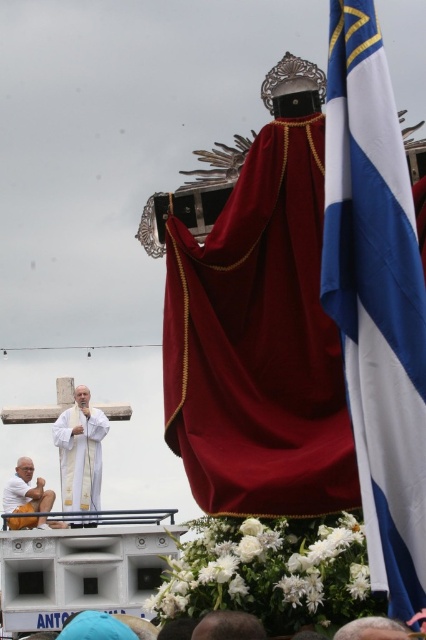
From the picture: Who is positioned more to the left, velvet deep red cape at center or smooth brown leather hat at lower center?

From the viewer's perspective, velvet deep red cape at center appears more on the left side.

Can you confirm if velvet deep red cape at center is shorter than smooth brown leather hat at lower center?

Incorrect, velvet deep red cape at center's height does not fall short of smooth brown leather hat at lower center's.

Between point (262, 424) and point (351, 636), which one is positioned behind?

Positioned behind is point (262, 424).

Identify the location of velvet deep red cape at center. (259, 342).

Does velvet deep red cape at center have a greater width compared to white cotton robe at lower left?

Yes.

Between velvet deep red cape at center and white cotton robe at lower left, which one has more height?

With more height is velvet deep red cape at center.

Where is `velvet deep red cape at center`? The width and height of the screenshot is (426, 640). velvet deep red cape at center is located at coordinates (259, 342).

The width and height of the screenshot is (426, 640). Find the location of `velvet deep red cape at center`. velvet deep red cape at center is located at coordinates (259, 342).